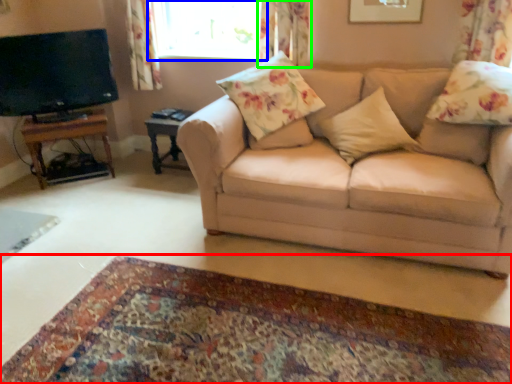
Question: Considering the real-world distances, which object is farthest from plain (highlighted by a red box)? window (highlighted by a blue box) or curtain (highlighted by a green box)?

Choices:
 (A) window
 (B) curtain

Answer: (A)